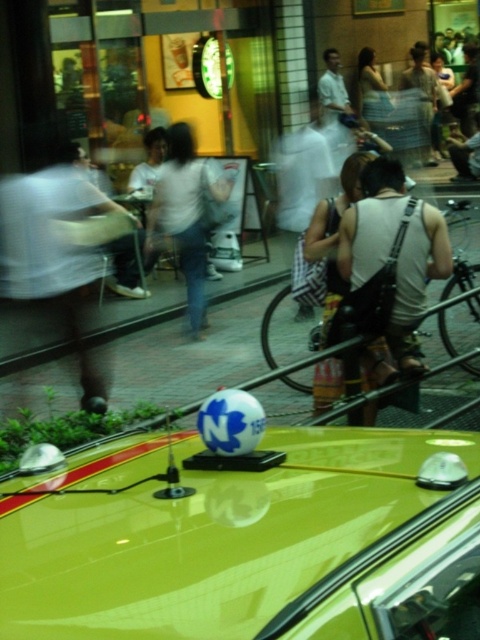
Which of these two, shiny yellow car at center or white cotton shirt at center, stands shorter?

shiny yellow car at center

Who is more distant from viewer, (320,584) or (216,182)?

Point (216,182)

Image resolution: width=480 pixels, height=640 pixels. Find the location of `shiny yellow car at center`. shiny yellow car at center is located at coordinates (245, 540).

You are a GUI agent. You are given a task and a screenshot of the screen. Output one action in this format:
    pyautogui.click(x=<x>, y=<y>)
    Task: Click on the matte white shirt at left
    
    Given the screenshot: What is the action you would take?
    pyautogui.click(x=54, y=252)

Is matte white shirt at left shorter than white matte tank top at center?

In fact, matte white shirt at left may be taller than white matte tank top at center.

Between point (78, 209) and point (397, 310), which one is positioned in front?

Point (397, 310)

I want to click on matte white shirt at left, so click(x=54, y=252).

Who is taller, white matte tank top at center or white tank top at center?

With more height is white tank top at center.

Measure the distance between point (382, 256) and camera.

The distance of point (382, 256) from camera is 4.28 meters.

This screenshot has width=480, height=640. Describe the element at coordinates (417, 284) in the screenshot. I see `white matte tank top at center` at that location.

Locate an element on the screen. white matte tank top at center is located at coordinates [x=417, y=284].